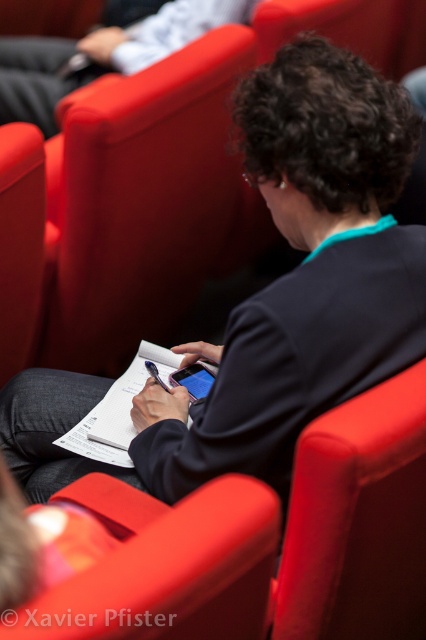
Is matte black jacket at upper center wider than white paper at center?

Correct, the width of matte black jacket at upper center exceeds that of white paper at center.

Does matte black jacket at upper center lie behind white paper at center?

Yes, it is behind white paper at center.

What do you see at coordinates (100, 54) in the screenshot? The height and width of the screenshot is (640, 426). I see `matte black jacket at upper center` at bounding box center [100, 54].

The height and width of the screenshot is (640, 426). In order to click on matte black jacket at upper center in this screenshot , I will do coord(100,54).

Who is more forward, (x=112, y=618) or (x=66, y=58)?

Point (x=112, y=618) is more forward.

Looking at this image, is matte red armchair at center to the left of matte black jacket at upper center from the viewer's perspective?

Incorrect, matte red armchair at center is not on the left side of matte black jacket at upper center.

Does point (106, 492) lie behind point (154, 49)?

No, (106, 492) is closer to viewer.

You are a GUI agent. You are given a task and a screenshot of the screen. Output one action in this format:
    pyautogui.click(x=<x>, y=<y>)
    Task: Click on the matte red armchair at center
    Image resolution: width=426 pixels, height=640 pixels.
    Given the screenshot: What is the action you would take?
    click(164, 566)

Does matte red armchair at center appear on the left side of white paper at center?

No, matte red armchair at center is not to the left of white paper at center.

The width and height of the screenshot is (426, 640). Describe the element at coordinates (164, 566) in the screenshot. I see `matte red armchair at center` at that location.

Image resolution: width=426 pixels, height=640 pixels. In order to click on matte red armchair at center in this screenshot , I will do `click(164, 566)`.